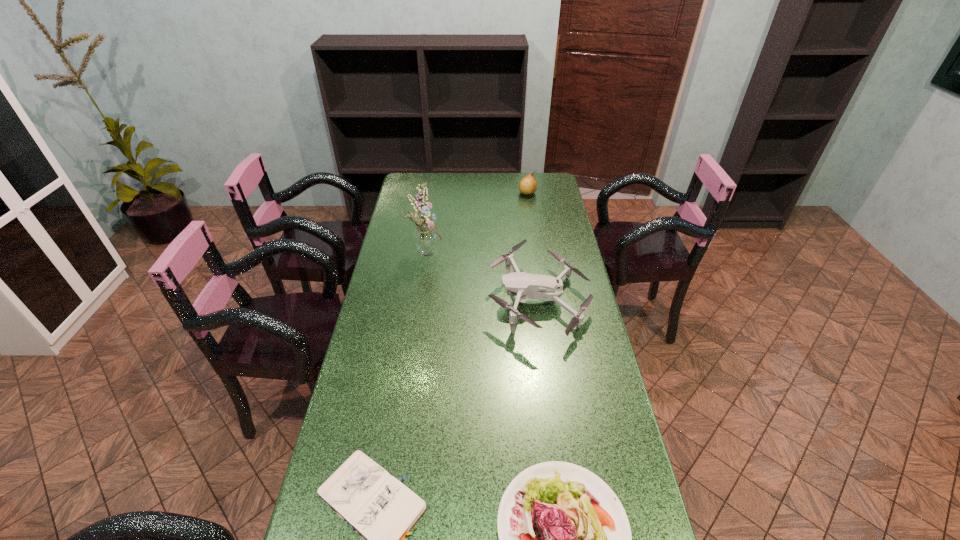
The image size is (960, 540). I want to click on empty space that is in between the bouquet and the drone, so click(x=483, y=276).

Locate which object is the closest to the pear. Please provide its 2D coordinates. Your answer should be formatted as a tuple, i.e. [(x, y)], where the tuple contains the x and y coordinates of a point satisfying the conditions above.

[(426, 242)]

Identify the location of the fourth closest object to the drone. This screenshot has width=960, height=540. (528, 185).